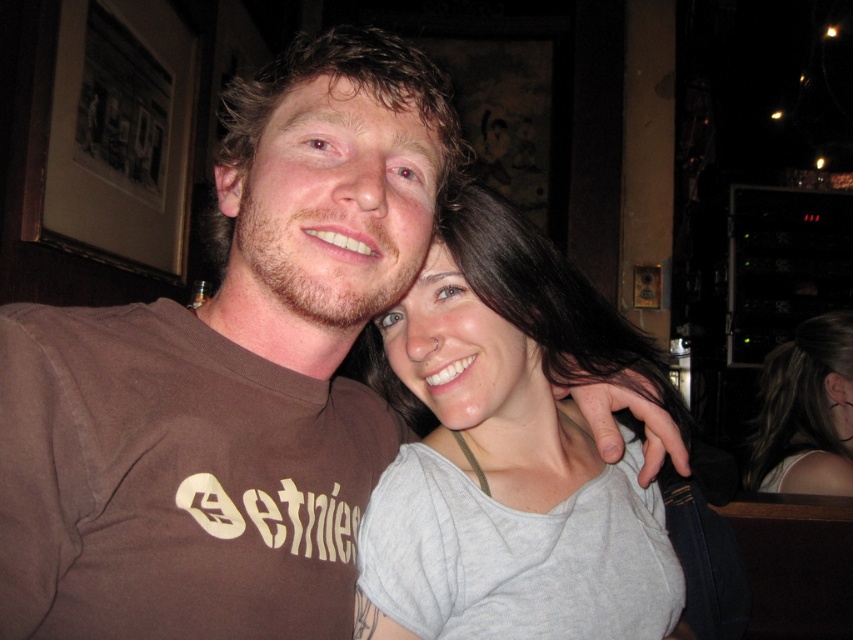
Question: Can you confirm if gray cotton shirt at center is smaller than gray fabric shirt at upper right?

Choices:
 (A) yes
 (B) no

Answer: (A)

Question: Can you confirm if gray cotton shirt at center is thinner than gray fabric shirt at upper right?

Choices:
 (A) yes
 (B) no

Answer: (B)

Question: Is gray cotton shirt at center above gray fabric shirt at upper right?

Choices:
 (A) yes
 (B) no

Answer: (A)

Question: Among these objects, which one is nearest to the camera?

Choices:
 (A) gray cotton shirt at center
 (B) gray fabric shirt at upper right

Answer: (A)

Question: Which point is farther to the camera?

Choices:
 (A) gray fabric shirt at upper right
 (B) gray cotton shirt at center

Answer: (A)